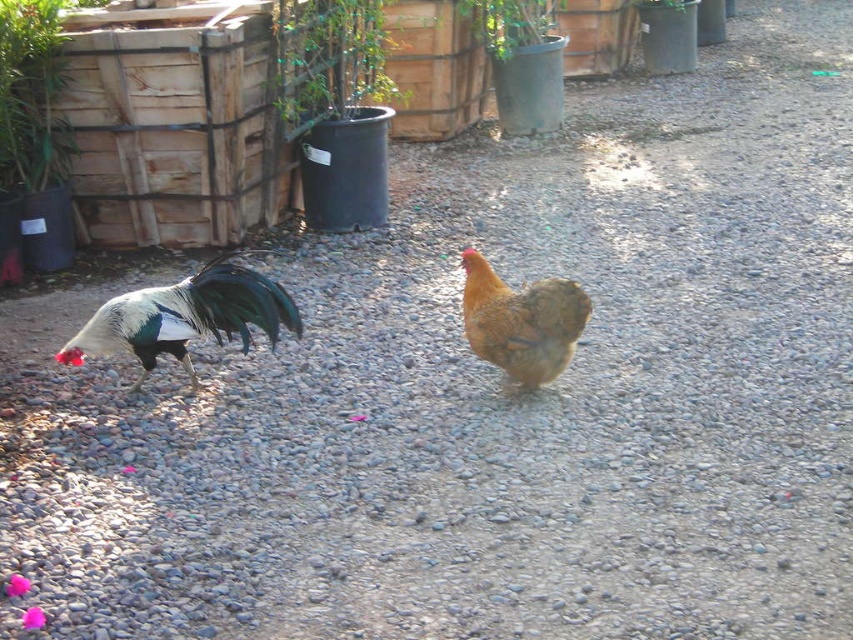
Question: Among these points, which one is nearest to the camera?

Choices:
 (A) (498, 1)
 (B) (648, 13)
 (C) (13, 40)

Answer: (C)

Question: Is green leafy plant at upper left closer to camera compared to green matte pot at upper center?

Choices:
 (A) no
 (B) yes

Answer: (B)

Question: Which is nearer to the brown feathered chicken at center?

Choices:
 (A) green matte pot at upper center
 (B) green leafy plant at upper center

Answer: (B)

Question: Which of the following is the closest to the observer?

Choices:
 (A) (670, 10)
 (B) (560, 344)
 (C) (57, 29)
 (D) (334, 116)

Answer: (B)

Question: Does green leafy plant at upper center have a greater width compared to green leafy plant at upper left?

Choices:
 (A) yes
 (B) no

Answer: (A)

Question: Does green glossy rooster at left have a lesser width compared to green leafy plant at upper left?

Choices:
 (A) yes
 (B) no

Answer: (B)